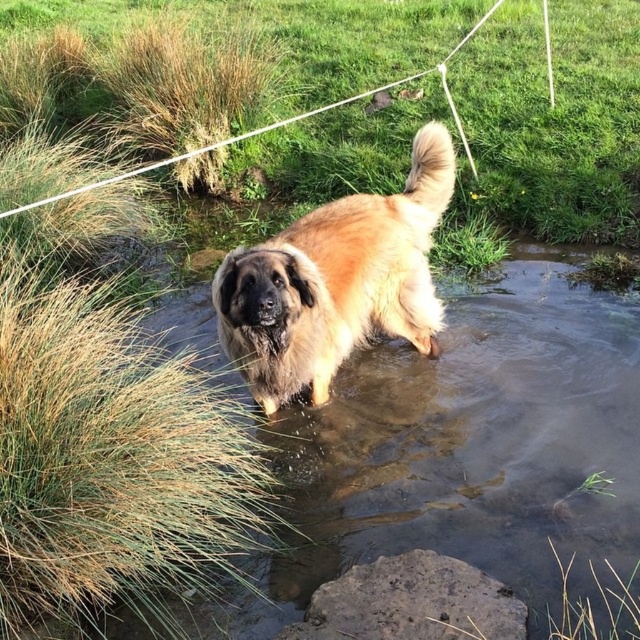
Question: Which point is closer to the camera?

Choices:
 (A) (312, 22)
 (B) (259, 250)

Answer: (B)

Question: Which object appears closest to the camera in this image?

Choices:
 (A) green grass at upper center
 (B) fuzzy brown dog at center

Answer: (B)

Question: Is green grass at upper center bigger than fuzzy brown dog at center?

Choices:
 (A) yes
 (B) no

Answer: (B)

Question: In this image, where is green grass at upper center located relative to fuzzy brown dog at center?

Choices:
 (A) right
 (B) left

Answer: (A)

Question: Is green grass at upper center to the left of fuzzy brown dog at center from the viewer's perspective?

Choices:
 (A) no
 (B) yes

Answer: (A)

Question: Which point is closer to the camera?

Choices:
 (A) fuzzy brown dog at center
 (B) green grass at upper center

Answer: (A)